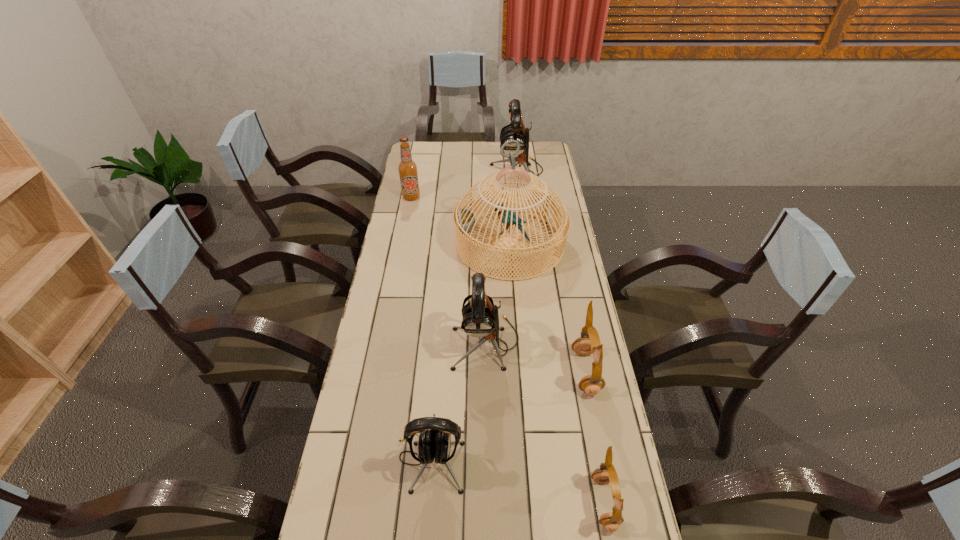
Identify the location of the nearer brown earphone. The height and width of the screenshot is (540, 960). (605, 473).

Identify the location of the smaller brown earphone. (605, 473).

This screenshot has width=960, height=540. I want to click on vacant space located 0.240m on the back of the third farthest object, so click(505, 180).

The height and width of the screenshot is (540, 960). I want to click on free space located on the front of the biggest black earphone, so click(x=519, y=196).

At what (x,y) coordinates should I click in order to perform the action: click on free location located 0.220m on the front of the second nearest black earphone. Please return your answer as a coordinate pair (x, y). This screenshot has height=540, width=960. Looking at the image, I should click on (487, 441).

Locate an element on the screen. This screenshot has width=960, height=540. vacant position located 0.370m on the front label of the beer bottle is located at coordinates (399, 259).

Identify the location of free region located 0.050m on the front-facing side of the farther brown earphone. (557, 372).

This screenshot has width=960, height=540. What are the coordinates of `free space located 0.220m on the front-facing side of the farther brown earphone` in the screenshot? It's located at (500, 372).

At what (x,y) coordinates should I click in order to perform the action: click on free location located on the front-facing side of the farther brown earphone. Please return your answer as a coordinate pair (x, y). Looking at the image, I should click on (557, 372).

This screenshot has width=960, height=540. I want to click on free space located on the back of the smallest black earphone, so click(442, 319).